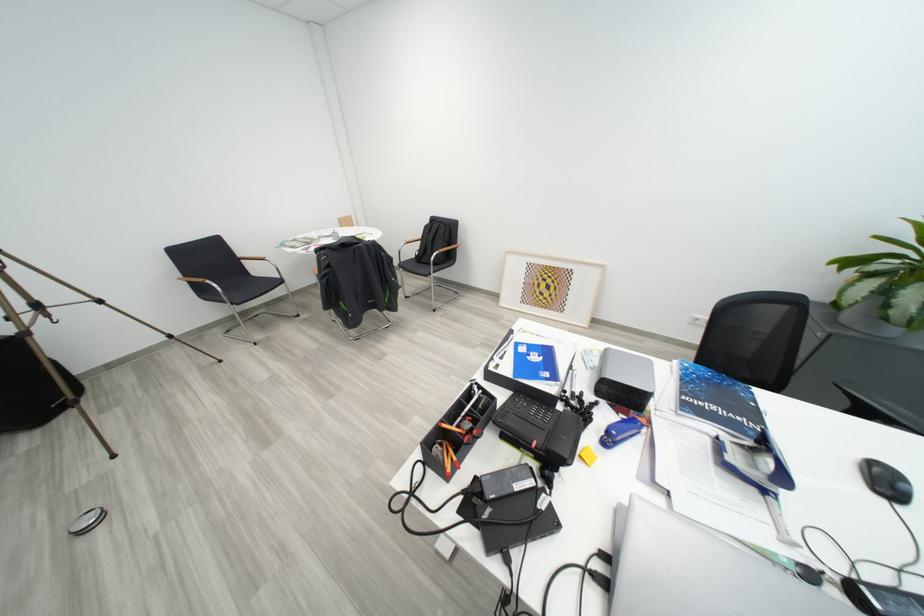
Where is `orange handled pliers`? orange handled pliers is located at coordinates (463, 432).